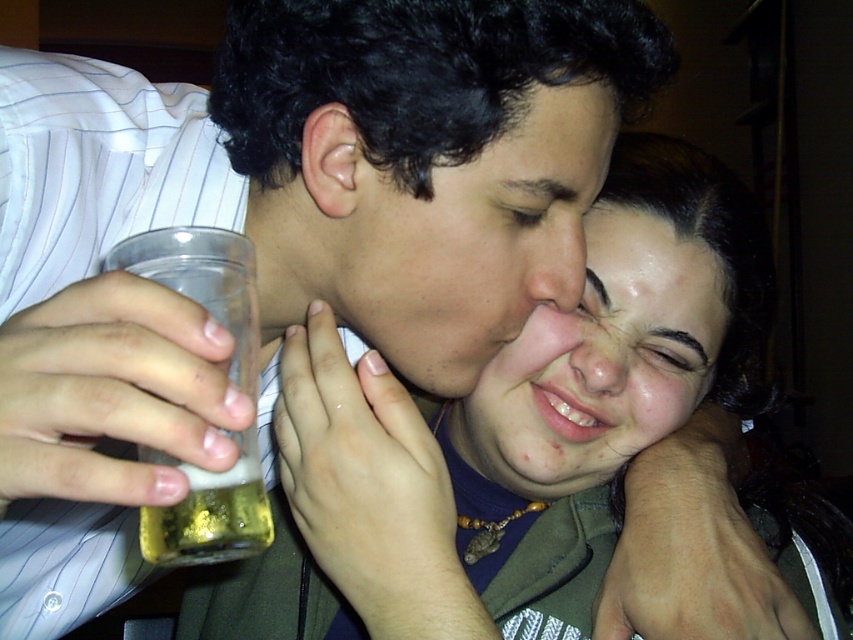
Question: Is matte skin face at center wider than translucent plastic cup at lower left?

Choices:
 (A) no
 (B) yes

Answer: (B)

Question: Which point is closer to the camera?

Choices:
 (A) matte skin face at center
 (B) glossy skin forehead at upper center
 (C) translucent plastic cup at lower left
 (D) oily skin face at center

Answer: (C)

Question: Which object is positioned farthest from the clear plastic cup at lower left?

Choices:
 (A) oily skin face at center
 (B) translucent plastic cup at lower left

Answer: (A)

Question: Among these objects, which one is farthest from the camera?

Choices:
 (A) matte skin face at center
 (B) glossy skin forehead at upper center
 (C) clear plastic cup at lower left
 (D) translucent plastic cup at lower left

Answer: (B)

Question: Is oily skin face at center to the left of translucent plastic cup at lower left from the viewer's perspective?

Choices:
 (A) no
 (B) yes

Answer: (A)

Question: Can you confirm if clear plastic cup at lower left is positioned above glossy skin forehead at upper center?

Choices:
 (A) yes
 (B) no

Answer: (B)